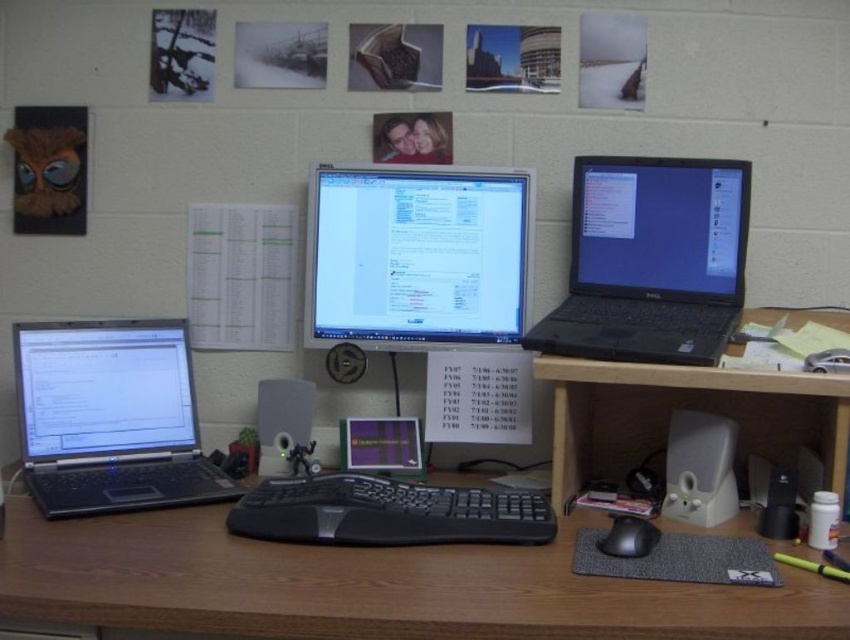
Question: Does matte black monitor at center appear on the right side of green paper at center?

Choices:
 (A) no
 (B) yes

Answer: (B)

Question: Is black plastic laptop at upper right smaller than black matte mouse at center?

Choices:
 (A) no
 (B) yes

Answer: (A)

Question: Among these objects, which one is farthest from the camera?

Choices:
 (A) matte black monitor at center
 (B) wooden at center
 (C) black plastic keyboard at center

Answer: (A)

Question: Which of the following is the closest to the observer?

Choices:
 (A) wooden at center
 (B) black plastic laptop at upper right
 (C) silver metallic laptop at left

Answer: (A)

Question: Where is silver metallic laptop at left located in relation to black matte mouse at center in the image?

Choices:
 (A) left
 (B) right

Answer: (A)

Question: Estimate the real-world distances between objects in this image. Which object is farther from the black plastic laptop at upper right?

Choices:
 (A) black matte mouse at center
 (B) green paper at center
 (C) wooden at center
 (D) black plastic keyboard at center

Answer: (B)